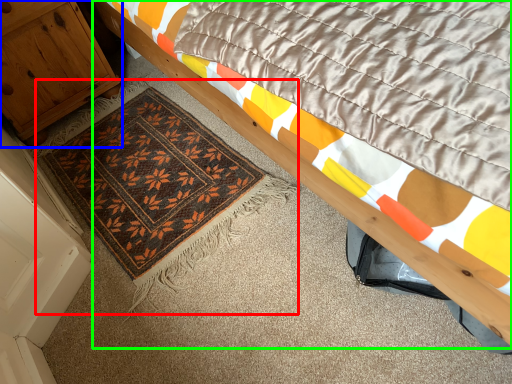
Question: Estimate the real-world distances between objects in this image. Which object is closer to mat (highlighted by a red box), cabinetry (highlighted by a blue box) or bed (highlighted by a green box)?

Choices:
 (A) cabinetry
 (B) bed

Answer: (A)